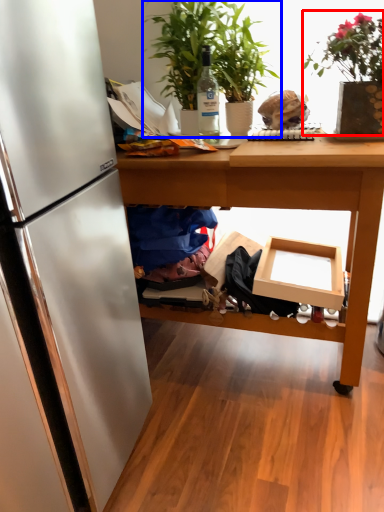
Question: Which point is closer to the camera, houseplant (highlighted by a red box) or houseplant (highlighted by a blue box)?

Choices:
 (A) houseplant
 (B) houseplant

Answer: (A)